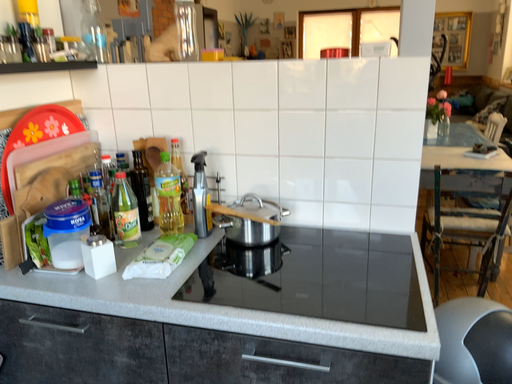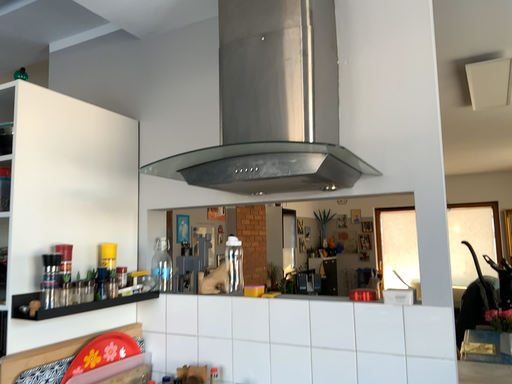
Question: How did the camera likely rotate when shooting the video?

Choices:
 (A) rotated right
 (B) rotated left

Answer: (B)